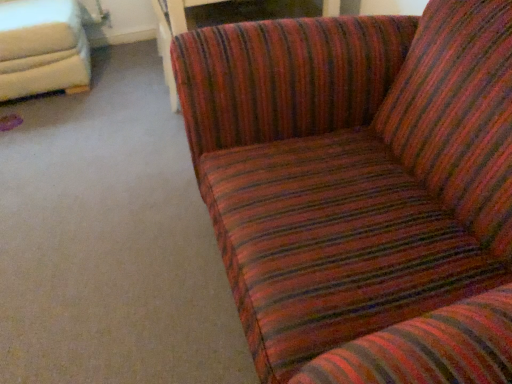
Question: Based on their sizes in the image, would you say white leather studio couch at upper left, marked as the second studio couch in a right-to-left arrangement, is bigger or smaller than wooden table at center?

Choices:
 (A) big
 (B) small

Answer: (A)

Question: In the image, is white leather studio couch at upper left, marked as the second studio couch in a right-to-left arrangement, on the left side or the right side of wooden table at center?

Choices:
 (A) right
 (B) left

Answer: (B)

Question: Estimate the real-world distances between objects in this image. Which object is closer to the white leather studio couch at upper left, marked as the second studio couch in a right-to-left arrangement?

Choices:
 (A) wooden table at center
 (B) striped fabric couch at upper right, marked as the first studio couch in a right-to-left arrangement

Answer: (A)

Question: Which is farther from the striped fabric couch at upper right, the second studio couch positioned from the left?

Choices:
 (A) wooden table at center
 (B) white leather studio couch at upper left, marked as the second studio couch in a right-to-left arrangement

Answer: (B)